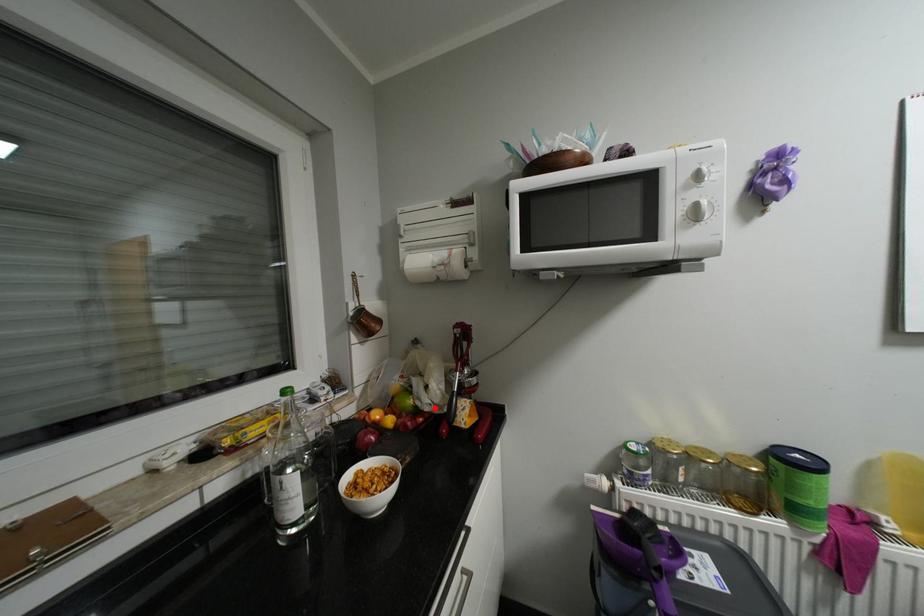
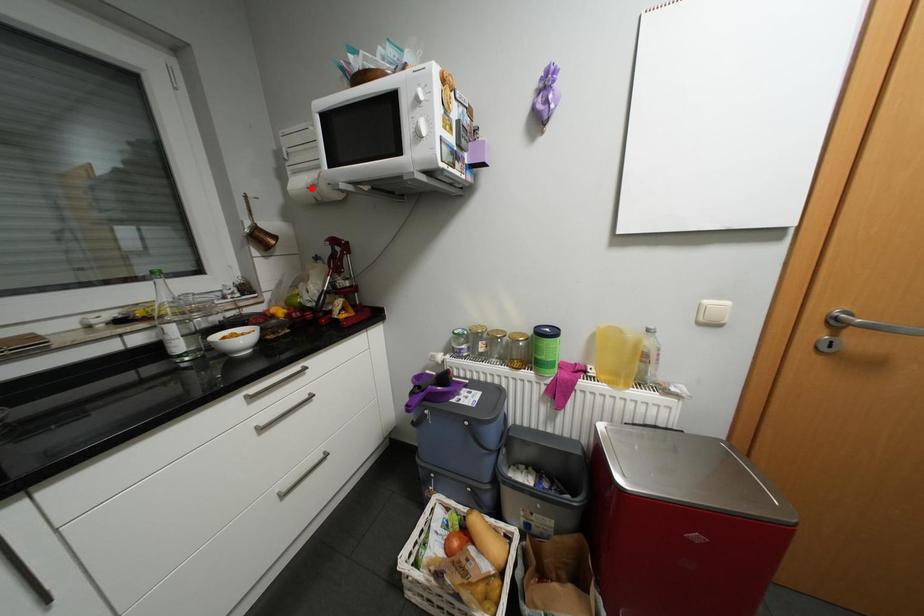
I am providing you with two images of the same scene from different viewpoints. A red point is marked on the first image and another point is marked on the second image. Is the red point in image1 aligned with the point shown in image2?

No